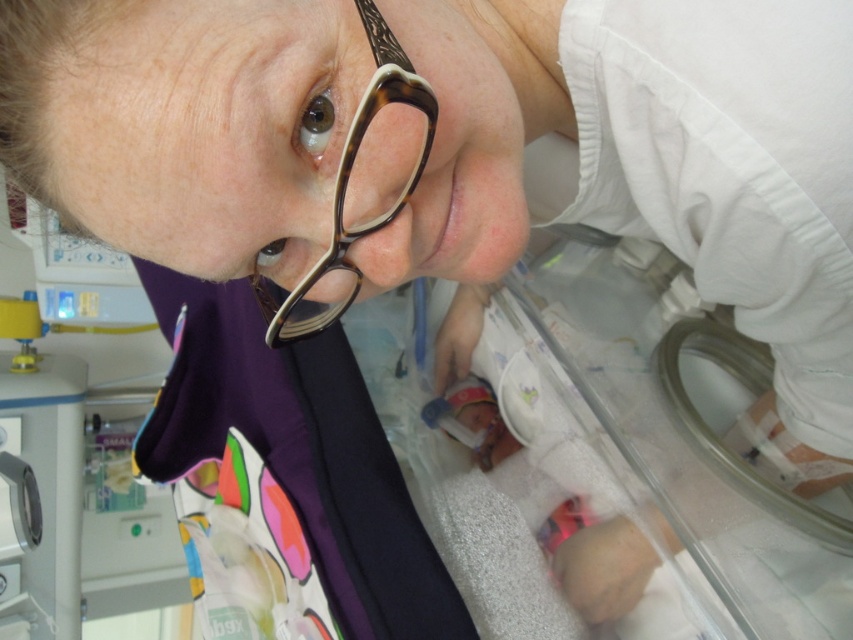
Between point (302, 337) and point (581, 588), which one is positioned behind?

Point (581, 588)

The width and height of the screenshot is (853, 640). What do you see at coordinates (358, 186) in the screenshot? I see `tortoiseshell frame glasses at upper center` at bounding box center [358, 186].

Locate an element on the screen. The image size is (853, 640). tortoiseshell frame glasses at upper center is located at coordinates (358, 186).